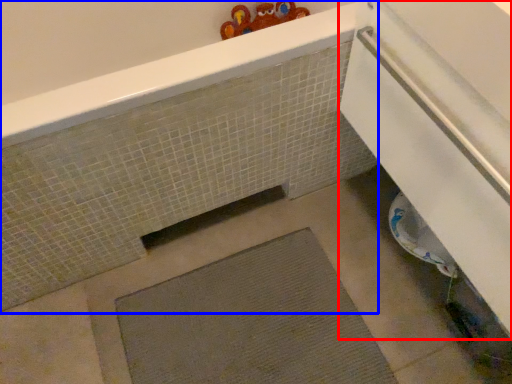
Question: Which of the following is the farthest to the observer, screen door (highlighted by a red box) or bath (highlighted by a blue box)?

Choices:
 (A) screen door
 (B) bath

Answer: (B)